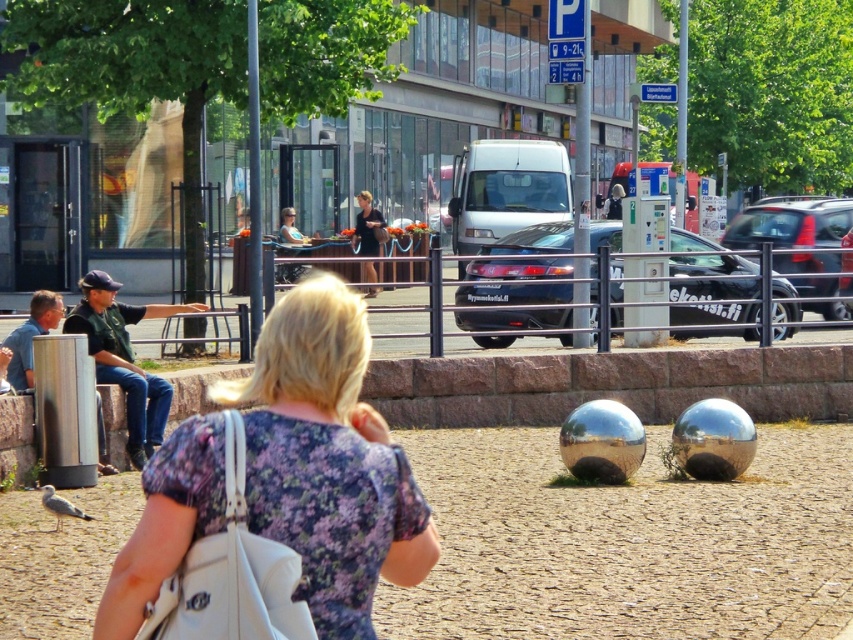
Is black glossy car at center thinner than jeans at left?

In fact, black glossy car at center might be wider than jeans at left.

Is black glossy car at center closer to the viewer compared to jeans at left?

No, black glossy car at center is behind jeans at left.

What do you see at coordinates (514, 292) in the screenshot? The image size is (853, 640). I see `black glossy car at center` at bounding box center [514, 292].

Image resolution: width=853 pixels, height=640 pixels. What are the coordinates of `black glossy car at center` in the screenshot? It's located at pyautogui.click(x=514, y=292).

Between floral fabric dress at center and dark blue shirt at center, which one has less height?

dark blue shirt at center is shorter.

Is floral fabric dress at center wider than dark blue shirt at center?

Yes, floral fabric dress at center is wider than dark blue shirt at center.

At what (x,y) coordinates should I click in order to perform the action: click on floral fabric dress at center. Please return your answer as a coordinate pair (x, y). Looking at the image, I should click on (328, 460).

From the picture: Is black glossy car at center shorter than metallic silver car at center?

Correct, black glossy car at center is not as tall as metallic silver car at center.

Between point (671, 320) and point (798, 237), which one is positioned behind?

The point (798, 237) is more distant.

Find the location of a particular element. Image resolution: width=853 pixels, height=640 pixels. black glossy car at center is located at coordinates (514, 292).